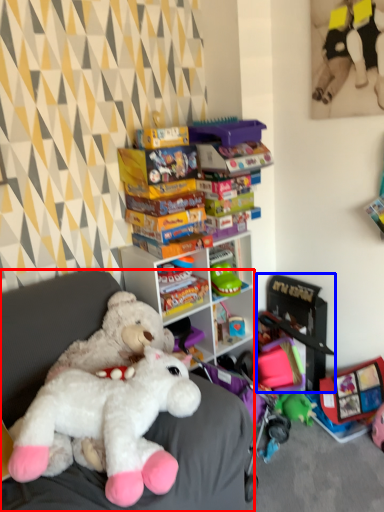
Question: Which object appears farthest to the camera in this image, furniture (highlighted by a red box) or toy (highlighted by a blue box)?

Choices:
 (A) furniture
 (B) toy

Answer: (B)